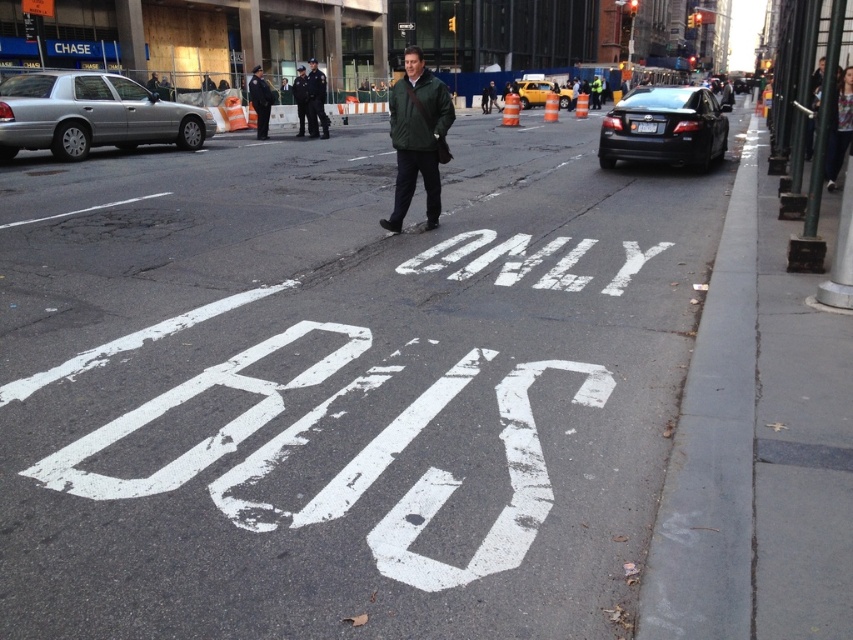
Identify the location of silver metallic sedan at left. (91, 115).

Between silver metallic sedan at left and dark blue uniform at center, which one appears on the right side from the viewer's perspective?

dark blue uniform at center is more to the right.

Identify the location of silver metallic sedan at left. The width and height of the screenshot is (853, 640). (91, 115).

Image resolution: width=853 pixels, height=640 pixels. Describe the element at coordinates (91, 115) in the screenshot. I see `silver metallic sedan at left` at that location.

Who is positioned more to the left, silver metallic sedan at left or white painted text at center?

silver metallic sedan at left

This screenshot has width=853, height=640. What do you see at coordinates (91, 115) in the screenshot?
I see `silver metallic sedan at left` at bounding box center [91, 115].

The height and width of the screenshot is (640, 853). I want to click on silver metallic sedan at left, so click(91, 115).

Is silver metallic sedan at left wider than green matte jacket at center?

Correct, the width of silver metallic sedan at left exceeds that of green matte jacket at center.

Looking at this image, is silver metallic sedan at left taller than green matte jacket at center?

No, silver metallic sedan at left is not taller than green matte jacket at center.

Between point (48, 104) and point (395, 189), which one is positioned behind?

Point (48, 104)

Where is `silver metallic sedan at left`? This screenshot has width=853, height=640. silver metallic sedan at left is located at coordinates (91, 115).